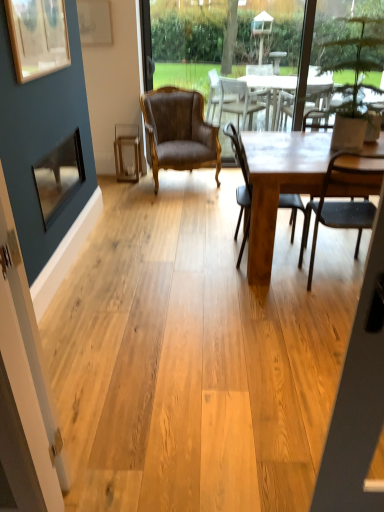
Locate an element on the screen. free space between matte brown chair at center, the first chair in the front-to-back sequence, and transparent glass screen door at left is located at coordinates (246, 352).